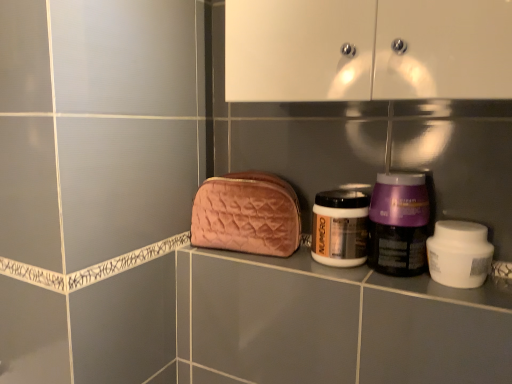
What do you see at coordinates (459, 254) in the screenshot? I see `white matte jar at right` at bounding box center [459, 254].

Measure the distance between white matte jar at right and camera.

A distance of 27.24 inches exists between white matte jar at right and camera.

Where is `velvet pink pouch at center`? This screenshot has width=512, height=384. velvet pink pouch at center is located at coordinates (247, 214).

This screenshot has height=384, width=512. What are the coordinates of `white matte jar at right` in the screenshot? It's located at (459, 254).

Considering the positions of points (485, 257) and (199, 238), is point (485, 257) farther from camera compared to point (199, 238)?

No, it is in front of (199, 238).

Can you confirm if white matte jar at right is positioned to the left of velvet pink pouch at center?

No, white matte jar at right is not to the left of velvet pink pouch at center.

Is white matte jar at right aimed at velvet pink pouch at center?

No.

Is white matte jar at right smaller than velvet pink pouch at center?

Yes, white matte jar at right is smaller than velvet pink pouch at center.

Visually, is white matte jar at right positioned to the left or to the right of purple glossy jar at center-right, the 1th bottle when ordered from right to left?

Clearly, white matte jar at right is on the right of purple glossy jar at center-right, the 1th bottle when ordered from right to left, in the image.

Can you confirm if white matte jar at right is bigger than purple glossy jar at center-right, the 1th bottle when ordered from right to left?

Actually, white matte jar at right might be smaller than purple glossy jar at center-right, the 1th bottle when ordered from right to left.

Where is `bottle that is the 2nd one above the white matte jar at right (from a real-world perspective)`? bottle that is the 2nd one above the white matte jar at right (from a real-world perspective) is located at coordinates (399, 224).

From the image's perspective, is white matte jar at right located beneath purple glossy jar at center-right, marked as the second bottle in a left-to-right arrangement?

Yes.

Consider the image. Which object is further away from the camera, purple glossy jar at center-right, the 1th bottle when ordered from right to left, or velvet pink pouch at center?

velvet pink pouch at center.

Is purple glossy jar at center-right, marked as the second bottle in a left-to-right arrangement, directly adjacent to velvet pink pouch at center?

No, purple glossy jar at center-right, marked as the second bottle in a left-to-right arrangement, is not beside velvet pink pouch at center.

Is purple glossy jar at center-right, the 1th bottle when ordered from right to left, oriented towards velvet pink pouch at center?

No.

From the image's perspective, is purple glossy jar at center-right, the 1th bottle when ordered from right to left, beneath velvet pink pouch at center?

Yes.

Is purple glossy jar at center-right, the 1th bottle when ordered from right to left, wider than matte gold jar at center, the first bottle in the left-to-right sequence?

Incorrect, the width of purple glossy jar at center-right, the 1th bottle when ordered from right to left, does not surpass that of matte gold jar at center, the first bottle in the left-to-right sequence.

Does point (410, 235) come behind point (348, 264)?

No.

Does purple glossy jar at center-right, marked as the second bottle in a left-to-right arrangement, have a larger size compared to matte gold jar at center, the second bottle positioned from the right?

Yes.

Is purple glossy jar at center-right, marked as the second bottle in a left-to-right arrangement, turned away from matte gold jar at center, the second bottle positioned from the right?

No, purple glossy jar at center-right, marked as the second bottle in a left-to-right arrangement, is not facing the opposite direction of matte gold jar at center, the second bottle positioned from the right.

Locate an element on the screen. This screenshot has width=512, height=384. bottle on the left of purple glossy jar at center-right, the 1th bottle when ordered from right to left is located at coordinates (340, 228).

Is point (352, 240) farther from viewer compared to point (373, 257)?

Yes, point (352, 240) is farther from viewer.

Would you say matte gold jar at center, the second bottle positioned from the right, is outside purple glossy jar at center-right, the 1th bottle when ordered from right to left?

matte gold jar at center, the second bottle positioned from the right, is positioned outside purple glossy jar at center-right, the 1th bottle when ordered from right to left.

In terms of size, does white matte jar at right appear bigger or smaller than matte gold jar at center, the second bottle positioned from the right?

In the image, white matte jar at right appears to be smaller than matte gold jar at center, the second bottle positioned from the right.

From the image's perspective, which is above, white matte jar at right or matte gold jar at center, the second bottle positioned from the right?

matte gold jar at center, the second bottle positioned from the right, from the image's perspective.

Considering the positions of objects white matte jar at right and matte gold jar at center, the second bottle positioned from the right, in the image provided, who is in front, white matte jar at right or matte gold jar at center, the second bottle positioned from the right,?

white matte jar at right is more forward.

Find the location of a particular element. product in front of the matte gold jar at center, the second bottle positioned from the right is located at coordinates (459, 254).

Could you tell me if matte gold jar at center, the second bottle positioned from the right, is turned towards velvet pink pouch at center?

No, matte gold jar at center, the second bottle positioned from the right, is not facing towards velvet pink pouch at center.

Between matte gold jar at center, the second bottle positioned from the right, and velvet pink pouch at center, which one is positioned behind?

velvet pink pouch at center is more distant.

From the image's perspective, is matte gold jar at center, the first bottle in the left-to-right sequence, positioned above or below velvet pink pouch at center?

Clearly, from the image's perspective, matte gold jar at center, the first bottle in the left-to-right sequence, is below velvet pink pouch at center.

Do you think matte gold jar at center, the second bottle positioned from the right, is within velvet pink pouch at center, or outside of it?

matte gold jar at center, the second bottle positioned from the right, is spatially situated outside velvet pink pouch at center.

Find the location of a particular element. This screenshot has width=512, height=384. product that appears in front of the velvet pink pouch at center is located at coordinates (459, 254).

There is a white matte jar at right. Where is `the 2nd bottle above it (from the image's perspective)`? The width and height of the screenshot is (512, 384). the 2nd bottle above it (from the image's perspective) is located at coordinates (399, 224).

Looking at the image, which one is located further to white matte jar at right, matte gold jar at center, the first bottle in the left-to-right sequence, or purple glossy jar at center-right, the 1th bottle when ordered from right to left?

Among the two, matte gold jar at center, the first bottle in the left-to-right sequence, is located further to white matte jar at right.

When comparing their distances from white matte jar at right, does purple glossy jar at center-right, marked as the second bottle in a left-to-right arrangement, or matte gold jar at center, the second bottle positioned from the right, seem closer?

purple glossy jar at center-right, marked as the second bottle in a left-to-right arrangement, lies closer to white matte jar at right than the other object.

Based on their spatial positions, is matte gold jar at center, the second bottle positioned from the right, or velvet pink pouch at center closer to white matte jar at right?

Among the two, matte gold jar at center, the second bottle positioned from the right, is located nearer to white matte jar at right.

Estimate the real-world distances between objects in this image. Which object is further from velvet pink pouch at center, purple glossy jar at center-right, marked as the second bottle in a left-to-right arrangement, or matte gold jar at center, the first bottle in the left-to-right sequence?

purple glossy jar at center-right, marked as the second bottle in a left-to-right arrangement, lies further to velvet pink pouch at center than the other object.

Estimate the real-world distances between objects in this image. Which object is further from matte gold jar at center, the first bottle in the left-to-right sequence, purple glossy jar at center-right, marked as the second bottle in a left-to-right arrangement, or white matte jar at right?

white matte jar at right.

Consider the image. When comparing their distances from purple glossy jar at center-right, marked as the second bottle in a left-to-right arrangement, does white matte jar at right or matte gold jar at center, the second bottle positioned from the right, seem closer?

white matte jar at right.

When comparing their distances from matte gold jar at center, the first bottle in the left-to-right sequence, does velvet pink pouch at center or white matte jar at right seem further?

white matte jar at right is further to matte gold jar at center, the first bottle in the left-to-right sequence.

When comparing their distances from matte gold jar at center, the second bottle positioned from the right, does white matte jar at right or purple glossy jar at center-right, the 1th bottle when ordered from right to left, seem closer?

purple glossy jar at center-right, the 1th bottle when ordered from right to left.

Image resolution: width=512 pixels, height=384 pixels. What are the coordinates of `bottle between velvet pink pouch at center and purple glossy jar at center-right, the 1th bottle when ordered from right to left, in the horizontal direction` in the screenshot? It's located at (340, 228).

The width and height of the screenshot is (512, 384). Find the location of `bottle between matte gold jar at center, the second bottle positioned from the right, and white matte jar at right`. bottle between matte gold jar at center, the second bottle positioned from the right, and white matte jar at right is located at coordinates point(399,224).